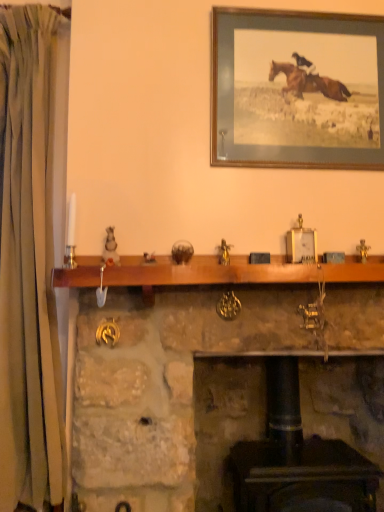
Where is `wooden picture frame at upper center`? wooden picture frame at upper center is located at coordinates (297, 89).

Describe the element at coordinates (28, 266) in the screenshot. I see `green fabric curtain at left` at that location.

Measure the distance between point (107, 280) and camera.

They are 1.22 meters apart.

In order to face stone fireplace at center, should I rotate leftwards or rightwards?

A 11.206 degree turn to the right will do.

Find the location of a particular element. The image size is (384, 512). wooden picture frame at upper center is located at coordinates (297, 89).

Based on the photo, which of these two, stone fireplace at center or green fabric curtain at left, is wider?

stone fireplace at center is wider.

Are stone fireplace at center and green fabric curtain at left making contact?

stone fireplace at center and green fabric curtain at left are clearly separated.

Does point (273, 407) appear closer or farther from the camera than point (1, 401)?

Clearly, point (273, 407) is more distant from the camera than point (1, 401).

Based on the photo, can you confirm if stone fireplace at center is positioned to the right of green fabric curtain at left?

Yes, stone fireplace at center is to the right of green fabric curtain at left.

How different are the orientations of wooden mantle at center and green fabric curtain at left in degrees?

They differ by 4.48 degrees in their facing directions.

Where is `curtain lying above the wooden mantle at center (from the image's perspective)`? curtain lying above the wooden mantle at center (from the image's perspective) is located at coordinates (28, 266).

Looking at their sizes, would you say wooden mantle at center is wider or thinner than green fabric curtain at left?

In the image, wooden mantle at center appears to be more narrow than green fabric curtain at left.

From a real-world perspective, which is physically above, wooden mantle at center or green fabric curtain at left?

green fabric curtain at left is physically above.

At what (x,y) coordinates should I click in order to perform the action: click on mantle below the green fabric curtain at left (from the image's perspective). Please return your answer as a coordinate pair (x, y). The width and height of the screenshot is (384, 512). Looking at the image, I should click on (239, 271).

Considering the points (14, 254) and (254, 269), which point is in front, point (14, 254) or point (254, 269)?

Positioned in front is point (254, 269).

Can we say wooden picture frame at upper center lies outside green fabric curtain at left?

Indeed, wooden picture frame at upper center is completely outside green fabric curtain at left.

Can you tell me how much wooden picture frame at upper center and green fabric curtain at left differ in facing direction?

The facing directions of wooden picture frame at upper center and green fabric curtain at left are 4.25 degrees apart.

Between wooden picture frame at upper center and green fabric curtain at left, which one has less height?

Standing shorter between the two is wooden picture frame at upper center.

Considering the relative positions of wooden picture frame at upper center and green fabric curtain at left in the image provided, is wooden picture frame at upper center to the left or to the right of green fabric curtain at left?

From the image, it's evident that wooden picture frame at upper center is to the right of green fabric curtain at left.

The image size is (384, 512). In the image, there is a stone fireplace at center. In order to click on curtain above it (from the image's perspective) in this screenshot , I will do `click(28, 266)`.

In the scene shown: Considering the sizes of objects green fabric curtain at left and stone fireplace at center in the image provided, who is smaller, green fabric curtain at left or stone fireplace at center?

green fabric curtain at left.

Do you think green fabric curtain at left is within stone fireplace at center, or outside of it?

green fabric curtain at left is not enclosed by stone fireplace at center.

Based on the photo, is green fabric curtain at left turned away from stone fireplace at center?

green fabric curtain at left does not have its back to stone fireplace at center.

Is wooden picture frame at upper center oriented towards wooden mantle at center?

No, wooden picture frame at upper center does not turn towards wooden mantle at center.

Which is behind, wooden picture frame at upper center or wooden mantle at center?

wooden picture frame at upper center is behind.

Between wooden picture frame at upper center and wooden mantle at center, which one has smaller size?

wooden picture frame at upper center.

Choose the correct answer: Is wooden picture frame at upper center inside wooden mantle at center or outside it?

wooden picture frame at upper center is spatially situated outside wooden mantle at center.

Is point (218, 490) positioned in front of point (75, 281)?

No, (218, 490) is behind (75, 281).

Is stone fireplace at center not inside wooden mantle at center?

Yes, stone fireplace at center is located beyond the bounds of wooden mantle at center.

From the image's perspective, is stone fireplace at center located above wooden mantle at center?

No, from the image's perspective, stone fireplace at center is not on top of wooden mantle at center.

Who is bigger, stone fireplace at center or wooden mantle at center?

Bigger between the two is stone fireplace at center.

Where is `curtain on the left of stone fireplace at center`? curtain on the left of stone fireplace at center is located at coordinates (28, 266).

Locate an element on the screen. curtain above the wooden mantle at center (from a real-world perspective) is located at coordinates (28, 266).

Based on the photo, considering their positions, is stone fireplace at center positioned closer to wooden mantle at center than wooden picture frame at upper center?

stone fireplace at center is positioned closer to the anchor wooden mantle at center.

Considering their positions, is wooden mantle at center positioned further to green fabric curtain at left than wooden picture frame at upper center?

wooden picture frame at upper center is positioned further to the anchor green fabric curtain at left.

Considering their positions, is wooden mantle at center positioned further to green fabric curtain at left than stone fireplace at center?

wooden mantle at center is further to green fabric curtain at left.

Based on their spatial positions, is wooden mantle at center or green fabric curtain at left closer to stone fireplace at center?

wooden mantle at center lies closer to stone fireplace at center than the other object.

When comparing their distances from wooden picture frame at upper center, does stone fireplace at center or green fabric curtain at left seem further?

Among the two, green fabric curtain at left is located further to wooden picture frame at upper center.

From the image, which object appears to be nearer to wooden picture frame at upper center, wooden mantle at center or stone fireplace at center?

wooden mantle at center is positioned closer to the anchor wooden picture frame at upper center.

Estimate the real-world distances between objects in this image. Which object is closer to stone fireplace at center, wooden picture frame at upper center or wooden mantle at center?

Among the two, wooden mantle at center is located nearer to stone fireplace at center.

Consider the image. Which object lies further to the anchor point green fabric curtain at left, wooden picture frame at upper center or stone fireplace at center?

Among the two, wooden picture frame at upper center is located further to green fabric curtain at left.

At what (x,y) coordinates should I click in order to perform the action: click on mantle between wooden picture frame at upper center and stone fireplace at center in the vertical direction. Please return your answer as a coordinate pair (x, y). The height and width of the screenshot is (512, 384). Looking at the image, I should click on (239, 271).

At what (x,y) coordinates should I click in order to perform the action: click on curtain between wooden picture frame at upper center and stone fireplace at center in the vertical direction. Please return your answer as a coordinate pair (x, y). Looking at the image, I should click on (28, 266).

Where is `mantle between green fabric curtain at left and stone fireplace at center in the horizontal direction`? Image resolution: width=384 pixels, height=512 pixels. mantle between green fabric curtain at left and stone fireplace at center in the horizontal direction is located at coordinates (239, 271).

Find the location of a particular element. The height and width of the screenshot is (512, 384). mantle situated between green fabric curtain at left and wooden picture frame at upper center from left to right is located at coordinates (239, 271).